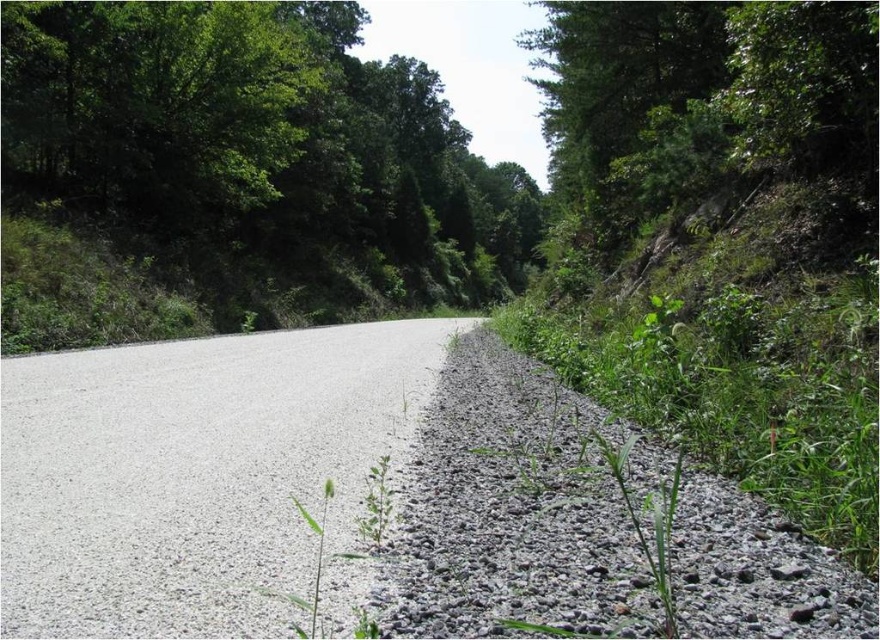
Question: Which of the following is the closest to the observer?

Choices:
 (A) green matte plant at center
 (B) gray gravel at right

Answer: (B)

Question: Which object is closer to the camera taking this photo?

Choices:
 (A) green grassy weed at center
 (B) gray asphalt road at center
 (C) gray gravel at right
 (D) green matte plant at center

Answer: (A)

Question: Can you confirm if gray gravel at right is positioned below green grassy weed at center?

Choices:
 (A) yes
 (B) no

Answer: (A)

Question: Does green leafy tree at upper center have a smaller size compared to gray asphalt road at center?

Choices:
 (A) yes
 (B) no

Answer: (B)

Question: Which point appears closest to the camera in this image?

Choices:
 (A) (618, 477)
 (B) (182, 76)
 (C) (565, 497)
 (D) (370, 532)

Answer: (A)

Question: Can you confirm if green leafy tree at upper center is positioned to the left of gray gravel at right?

Choices:
 (A) yes
 (B) no

Answer: (A)